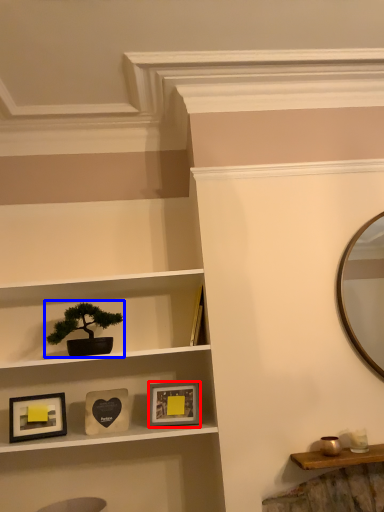
Question: Among these objects, which one is nearest to the camera, picture frame (highlighted by a red box) or houseplant (highlighted by a blue box)?

Choices:
 (A) picture frame
 (B) houseplant

Answer: (B)